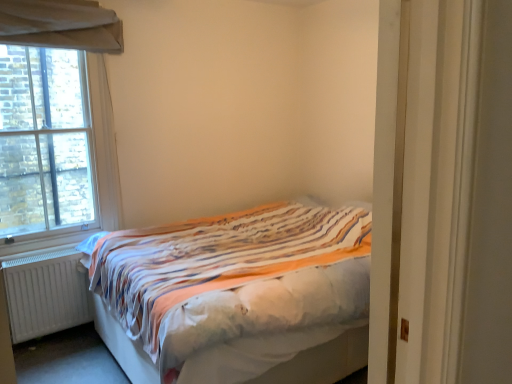
Question: Is brick textured window at left oriented away from striped fabric bed at center?

Choices:
 (A) yes
 (B) no

Answer: (B)

Question: Considering the relative sizes of brick textured window at left and striped fabric bed at center in the image provided, is brick textured window at left smaller than striped fabric bed at center?

Choices:
 (A) no
 (B) yes

Answer: (B)

Question: Considering the relative sizes of brick textured window at left and striped fabric bed at center in the image provided, is brick textured window at left taller than striped fabric bed at center?

Choices:
 (A) yes
 (B) no

Answer: (A)

Question: Does brick textured window at left have a greater width compared to striped fabric bed at center?

Choices:
 (A) no
 (B) yes

Answer: (A)

Question: From the image's perspective, does brick textured window at left appear higher than striped fabric bed at center?

Choices:
 (A) yes
 (B) no

Answer: (A)

Question: Is brick textured window at left to the left of striped fabric bed at center from the viewer's perspective?

Choices:
 (A) no
 (B) yes

Answer: (B)

Question: Is striped fabric bed at center facing towards brick textured window at left?

Choices:
 (A) yes
 (B) no

Answer: (B)

Question: Can you confirm if striped fabric bed at center is bigger than brick textured window at left?

Choices:
 (A) yes
 (B) no

Answer: (A)

Question: Is striped fabric bed at center completely or partially outside of brick textured window at left?

Choices:
 (A) no
 (B) yes

Answer: (B)

Question: Can you confirm if striped fabric bed at center is shorter than brick textured window at left?

Choices:
 (A) no
 (B) yes

Answer: (B)

Question: Is striped fabric bed at center further to the viewer compared to brick textured window at left?

Choices:
 (A) no
 (B) yes

Answer: (A)

Question: Can you confirm if striped fabric bed at center is thinner than brick textured window at left?

Choices:
 (A) no
 (B) yes

Answer: (A)

Question: Is white matte radiator at lower left to the left of striped fabric bed at center from the viewer's perspective?

Choices:
 (A) yes
 (B) no

Answer: (A)